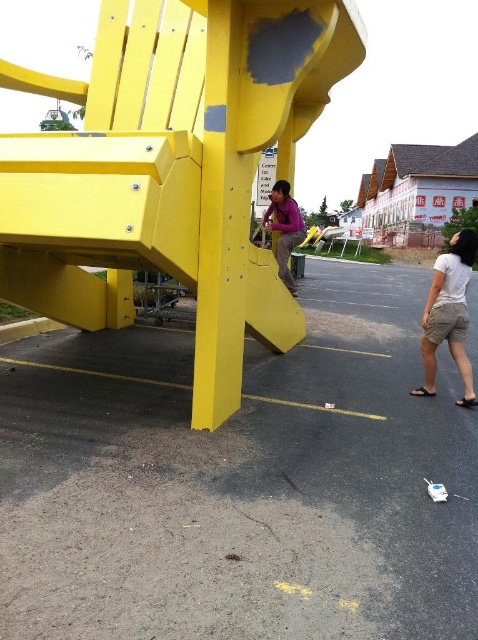
Question: Which point appears farthest from the camera in this image?

Choices:
 (A) (293, 241)
 (B) (45, 412)

Answer: (A)

Question: Based on their relative distances, which object is nearer to the yellow matte bench at lower left?

Choices:
 (A) white cotton shirt at lower right
 (B) purple matte shirt at center

Answer: (A)

Question: Which of the following is the farthest from the observer?

Choices:
 (A) (109, 524)
 (B) (282, 236)

Answer: (B)

Question: Can you confirm if white cotton shirt at lower right is wider than purple matte shirt at center?

Choices:
 (A) no
 (B) yes

Answer: (B)

Question: Can you confirm if white cotton shirt at lower right is wider than purple matte shirt at center?

Choices:
 (A) yes
 (B) no

Answer: (A)

Question: Does yellow matte bench at lower left have a lesser width compared to purple matte shirt at center?

Choices:
 (A) yes
 (B) no

Answer: (B)